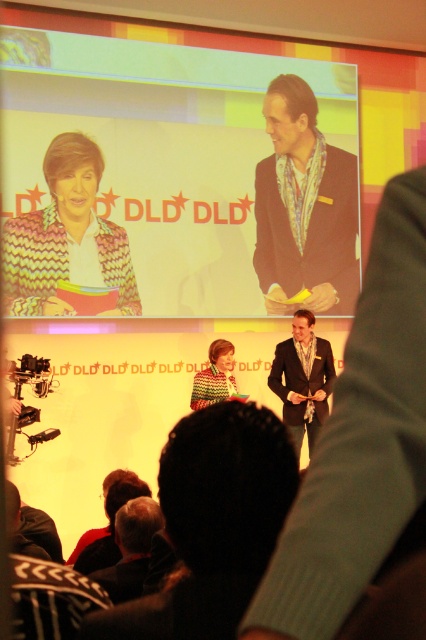
Is point (195, 529) positioned after point (275, 369)?

No, it is not.

Does patterned fabric suit at center have a greater height compared to shiny gold suit at center?

Incorrect, patterned fabric suit at center's height is not larger of shiny gold suit at center's.

You are a GUI agent. You are given a task and a screenshot of the screen. Output one action in this format:
    pyautogui.click(x=<x>, y=<y>)
    Task: Click on the patterned fabric suit at center
    The width and height of the screenshot is (426, 640).
    Given the screenshot: What is the action you would take?
    pyautogui.click(x=212, y=524)

Which is below, patterned fabric suit at upper right or knitted sweater at center?

knitted sweater at center is below.

Does point (287, 232) come behind point (207, 401)?

That is True.

This screenshot has height=640, width=426. Identify the location of patterned fabric suit at upper right. (305, 205).

Which is more to the right, shiny gold tie at center or knitted multicolor sweater at upper left?

shiny gold tie at center is more to the right.

Is point (402, 552) positioned after point (123, 230)?

No, (402, 552) is in front of (123, 230).

Locate an element on the screen. The height and width of the screenshot is (640, 426). shiny gold tie at center is located at coordinates click(x=365, y=461).